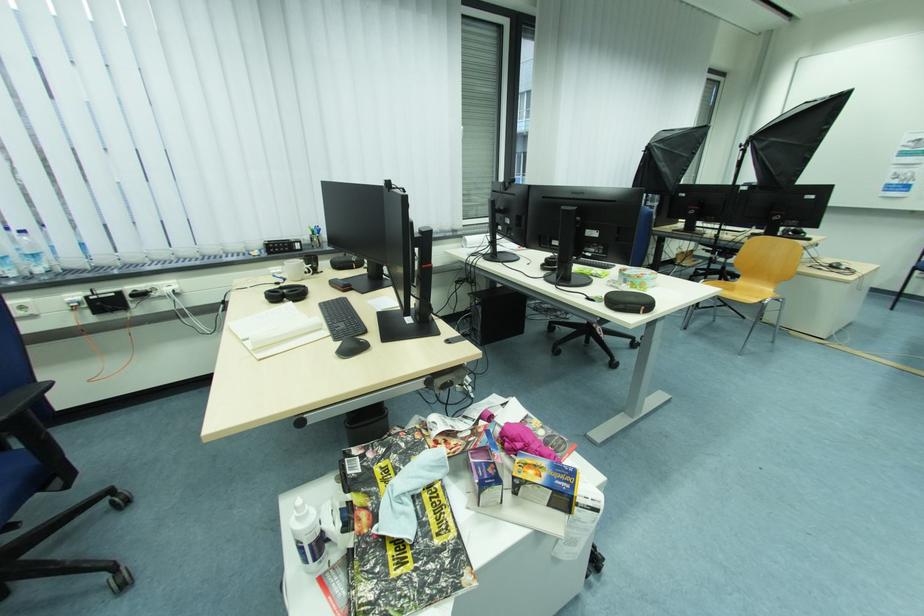
The width and height of the screenshot is (924, 616). Find the location of `black computer mouse`. black computer mouse is located at coordinates (351, 347).